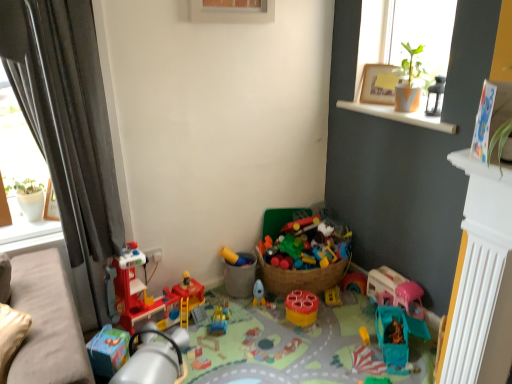
Identify the location of vacant space to the right of translucent plastic slide at center, which is the second toy from left to right. Image resolution: width=512 pixels, height=384 pixels. (252, 321).